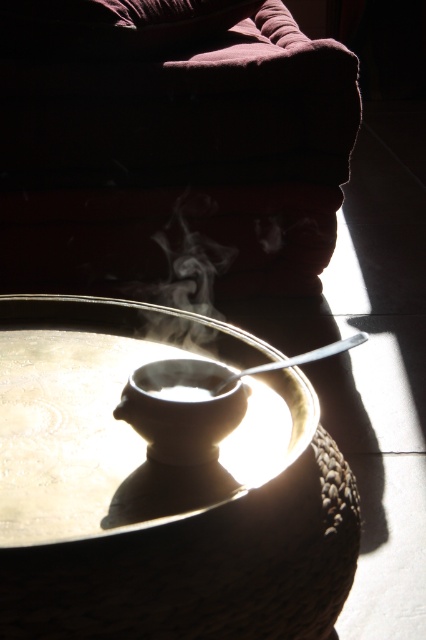
You are a barista trying to place the white matte coffee cup at center onto the white glossy saucer at center. Will the cup fit on the saucer without falling off?

The white glossy saucer at center is wider than the white matte coffee cup at center, so the cup will fit securely on the saucer without falling off.